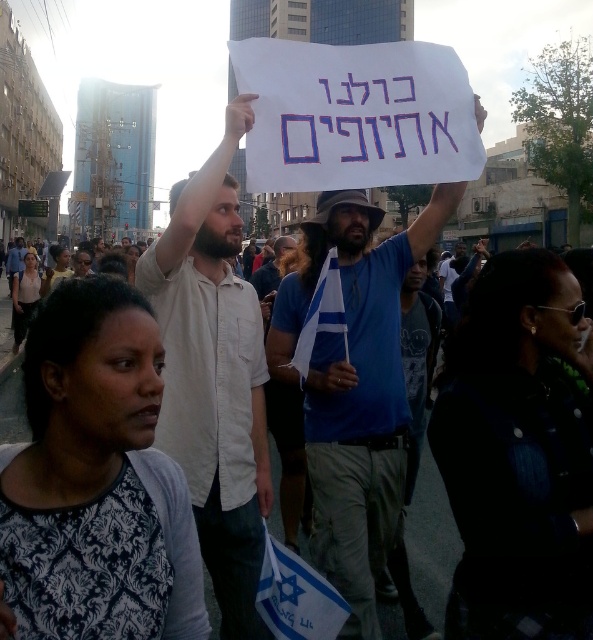
Question: Does white shirt at upper center come behind blue cotton shirt at center?

Choices:
 (A) yes
 (B) no

Answer: (B)

Question: Is white shirt at upper center smaller than blue cotton shirt at center?

Choices:
 (A) no
 (B) yes

Answer: (B)

Question: Does white shirt at upper center have a smaller size compared to blue cotton shirt at center?

Choices:
 (A) no
 (B) yes

Answer: (B)

Question: Which object is closer to the camera taking this photo?

Choices:
 (A) white shirt at upper center
 (B) blue cotton shirt at center

Answer: (A)

Question: Which object appears closest to the camera in this image?

Choices:
 (A) white shirt at upper center
 (B) blue cotton shirt at center

Answer: (A)